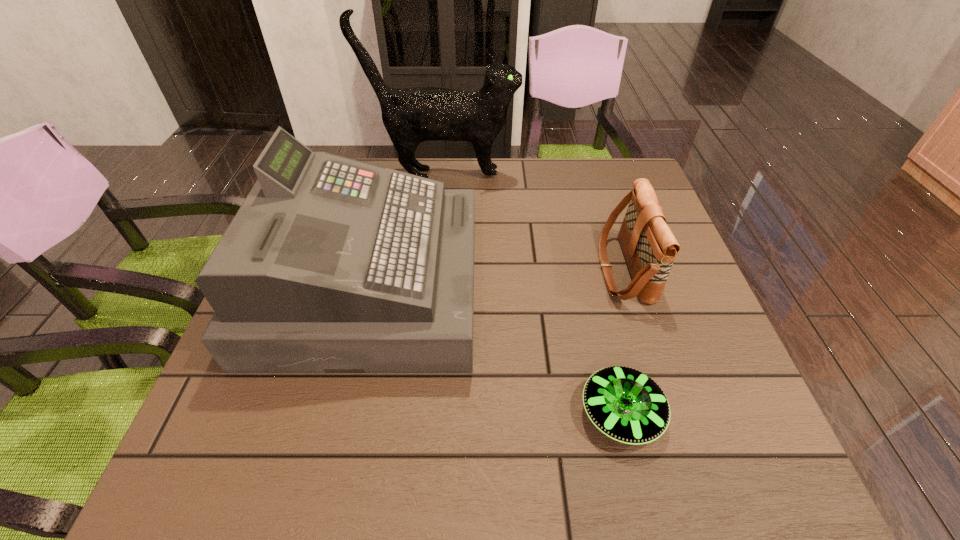
Locate an element on the screen. The image size is (960, 540). vacant area located 0.240m on the front-facing side of the second shortest object is located at coordinates (496, 269).

I want to click on vacant space positioned on the left of the nearest object, so click(386, 413).

Find the location of `object that is at the far edge`. object that is at the far edge is located at coordinates (412, 115).

Locate an element on the screen. The image size is (960, 540). object that is at the near edge is located at coordinates (625, 404).

The width and height of the screenshot is (960, 540). Identify the location of cat present at the left edge. (412, 115).

Locate an element on the screen. cash register that is positioned at the left edge is located at coordinates (331, 265).

This screenshot has width=960, height=540. Identify the location of shoulder bag at the right edge. (649, 246).

I want to click on saucer located in the right edge section of the desktop, so click(x=625, y=404).

Where is `object that is positioned at the far left corner`? object that is positioned at the far left corner is located at coordinates (412, 115).

Image resolution: width=960 pixels, height=540 pixels. In order to click on object situated at the near right corner in this screenshot , I will do pos(625,404).